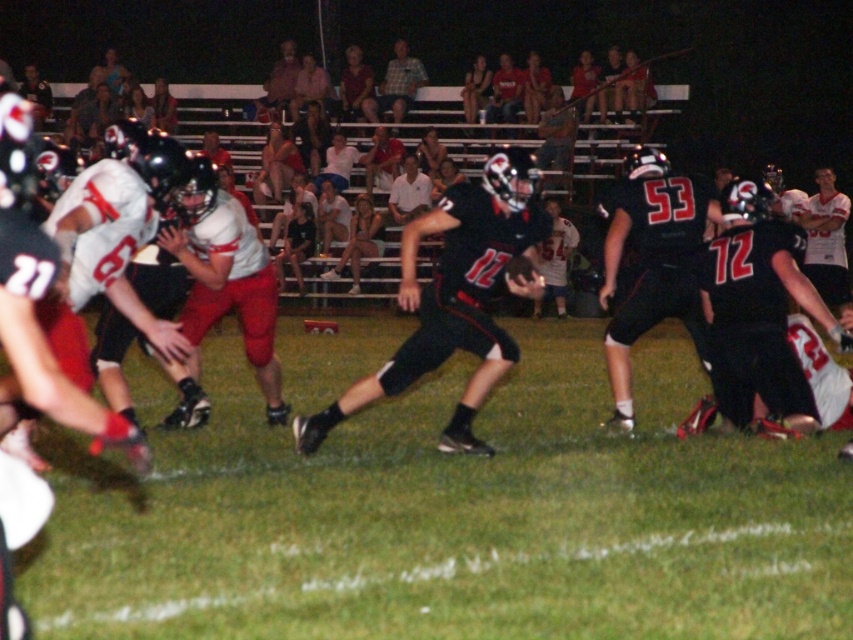
Is black matte football player at center to the left of white shirt at center from the viewer's perspective?

In fact, black matte football player at center is to the right of white shirt at center.

This screenshot has width=853, height=640. Describe the element at coordinates (456, 296) in the screenshot. I see `black matte football player at center` at that location.

Is point (531, 189) positioned after point (403, 189)?

No, it is not.

The image size is (853, 640). I want to click on black matte football player at center, so click(x=456, y=296).

Is white jersey at left positioned before plaid shirt at upper center?

Yes, it is.

I want to click on white jersey at left, so click(119, 227).

Who is higher up, black matte football player at center or white jersey at left?

Positioned higher is white jersey at left.

Who is more distant from viewer, (418, 285) or (102, 284)?

The point (418, 285) is behind.

Describe the element at coordinates (456, 296) in the screenshot. I see `black matte football player at center` at that location.

Find the location of a particular element. Image resolution: width=853 pixels, height=640 pixels. black matte football player at center is located at coordinates (456, 296).